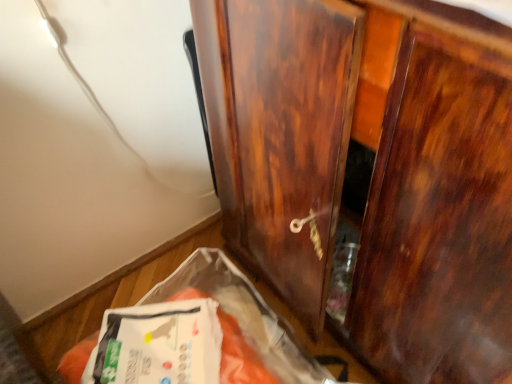
Question: Is glossy wood cupboard at center next to white plastic bag at lower left?

Choices:
 (A) yes
 (B) no

Answer: (B)

Question: From the image's perspective, is glossy wood cupboard at center above white plastic bag at lower left?

Choices:
 (A) yes
 (B) no

Answer: (A)

Question: From the image's perspective, is glossy wood cupboard at center located beneath white plastic bag at lower left?

Choices:
 (A) no
 (B) yes

Answer: (A)

Question: Is glossy wood cupboard at center looking in the opposite direction of white plastic bag at lower left?

Choices:
 (A) yes
 (B) no

Answer: (B)

Question: Is glossy wood cupboard at center closer to camera compared to white plastic bag at lower left?

Choices:
 (A) no
 (B) yes

Answer: (B)

Question: From a real-world perspective, is glossy wood cupboard at center beneath white plastic bag at lower left?

Choices:
 (A) no
 (B) yes

Answer: (A)

Question: Does white plastic bag at lower left have a greater height compared to glossy wood cupboard at center?

Choices:
 (A) no
 (B) yes

Answer: (A)

Question: Considering the relative positions of white plastic bag at lower left and glossy wood cupboard at center in the image provided, is white plastic bag at lower left to the left of glossy wood cupboard at center from the viewer's perspective?

Choices:
 (A) no
 (B) yes

Answer: (B)

Question: Is white plastic bag at lower left not within glossy wood cupboard at center?

Choices:
 (A) no
 (B) yes

Answer: (B)

Question: Can you confirm if white plastic bag at lower left is positioned to the right of glossy wood cupboard at center?

Choices:
 (A) yes
 (B) no

Answer: (B)

Question: From a real-world perspective, is white plastic bag at lower left located higher than glossy wood cupboard at center?

Choices:
 (A) no
 (B) yes

Answer: (A)

Question: Considering the relative sizes of white plastic bag at lower left and glossy wood cupboard at center in the image provided, is white plastic bag at lower left shorter than glossy wood cupboard at center?

Choices:
 (A) yes
 (B) no

Answer: (A)

Question: In the image, is glossy wood cupboard at center on the left side or the right side of white plastic bag at lower left?

Choices:
 (A) left
 (B) right

Answer: (B)